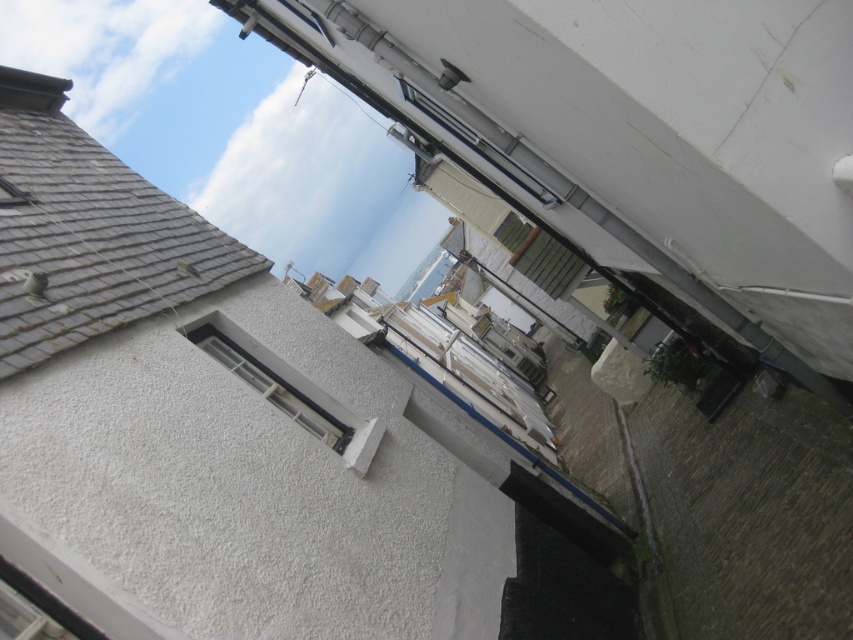
Question: Among these objects, which one is farthest from the camera?

Choices:
 (A) white textured window at upper center
 (B) gray shingles at upper left

Answer: (B)

Question: Is gray shingles at upper left below white textured window at upper center?

Choices:
 (A) yes
 (B) no

Answer: (B)

Question: Can you confirm if gray shingles at upper left is positioned to the left of white textured window at upper center?

Choices:
 (A) yes
 (B) no

Answer: (A)

Question: Is gray shingles at upper left positioned in front of white textured window at upper center?

Choices:
 (A) yes
 (B) no

Answer: (B)